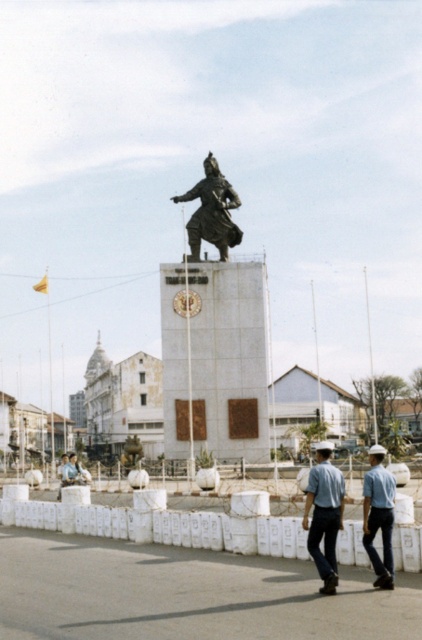
Question: Is white plastic bags at center behind bronze statue at center?

Choices:
 (A) no
 (B) yes

Answer: (A)

Question: Is bronze statue at center behind light blue uniform at center?

Choices:
 (A) no
 (B) yes

Answer: (B)

Question: Which object is farther from the camera taking this photo?

Choices:
 (A) blue uniform at lower center
 (B) white plastic bags at center
 (C) light blue uniform at center
 (D) bronze statue at center

Answer: (D)

Question: Estimate the real-world distances between objects in this image. Which object is farther from the blue uniform at lower center?

Choices:
 (A) light blue uniform at center
 (B) white plastic bags at center
 (C) bronze statue at center

Answer: (C)

Question: Which point is closer to the camera taking this photo?

Choices:
 (A) (389, 544)
 (B) (219, 234)
 (C) (38, 509)
 (D) (316, 496)

Answer: (A)

Question: Is blue uniform at lower center positioned in front of light blue uniform at center?

Choices:
 (A) no
 (B) yes

Answer: (B)